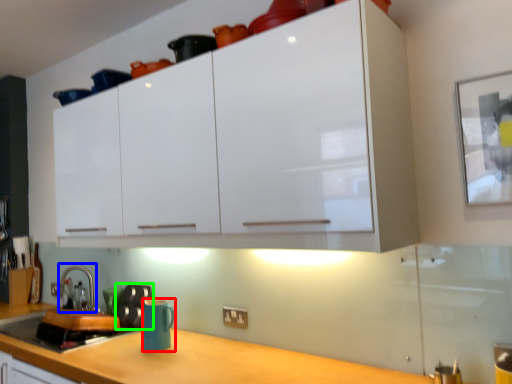
Question: Which object is positioned farthest from mug (highlighted by a red box)? Select from faucet (highlighted by a blue box) and appliance (highlighted by a green box).

Choices:
 (A) faucet
 (B) appliance

Answer: (A)